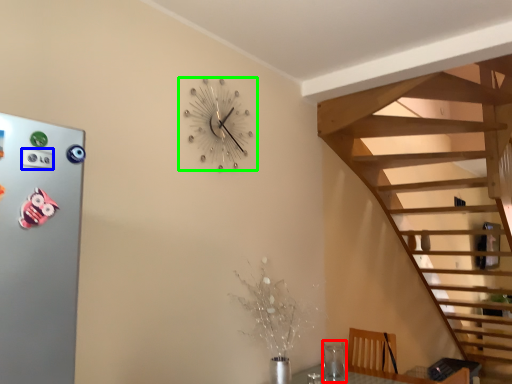
Question: Based on their relative distances, which object is nearer to glass vase (highlighted by a red box)? Choose from button (highlighted by a blue box) and wall clock (highlighted by a green box).

Choices:
 (A) button
 (B) wall clock

Answer: (B)